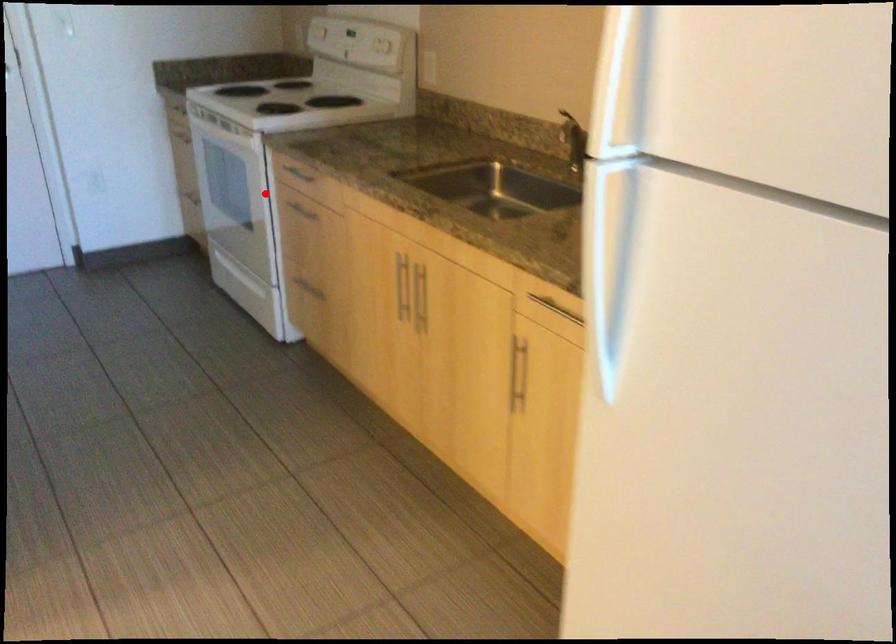
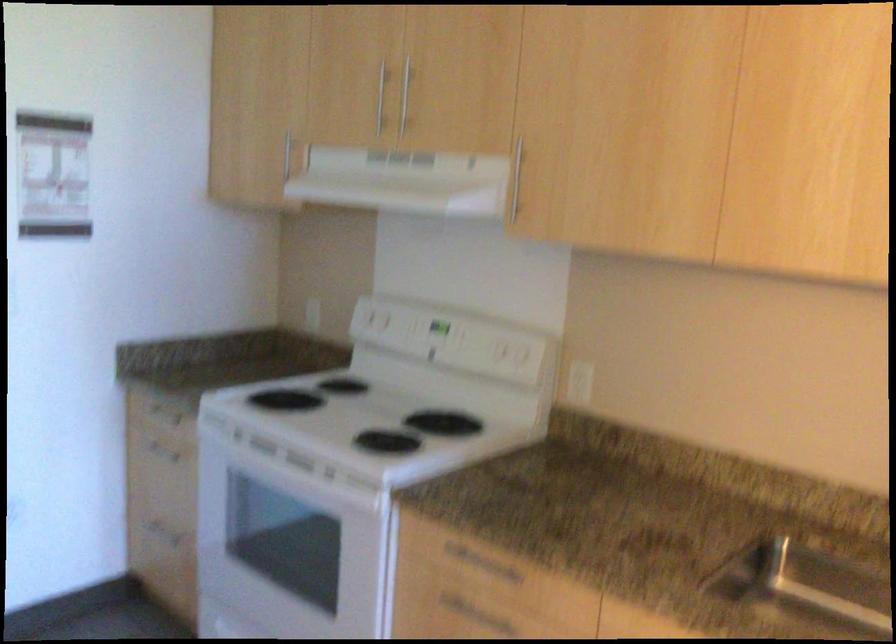
Question: I am providing you with two images of the same scene from different viewpoints. A red point is shown in image1. For the corresponding object point in image2, is it positioned nearer or farther from the camera?

Choices:
 (A) Nearer
 (B) Farther

Answer: (A)